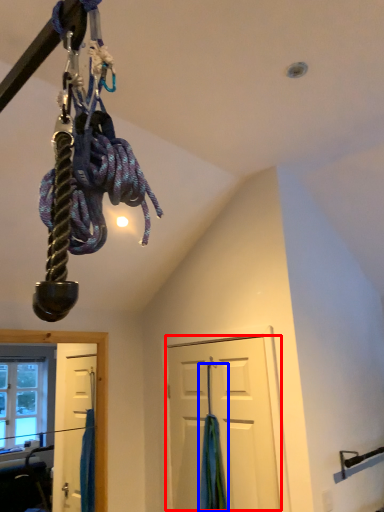
Question: Among these objects, which one is nearest to the camera, door (highlighted by a red box) or curtain (highlighted by a blue box)?

Choices:
 (A) door
 (B) curtain

Answer: (A)